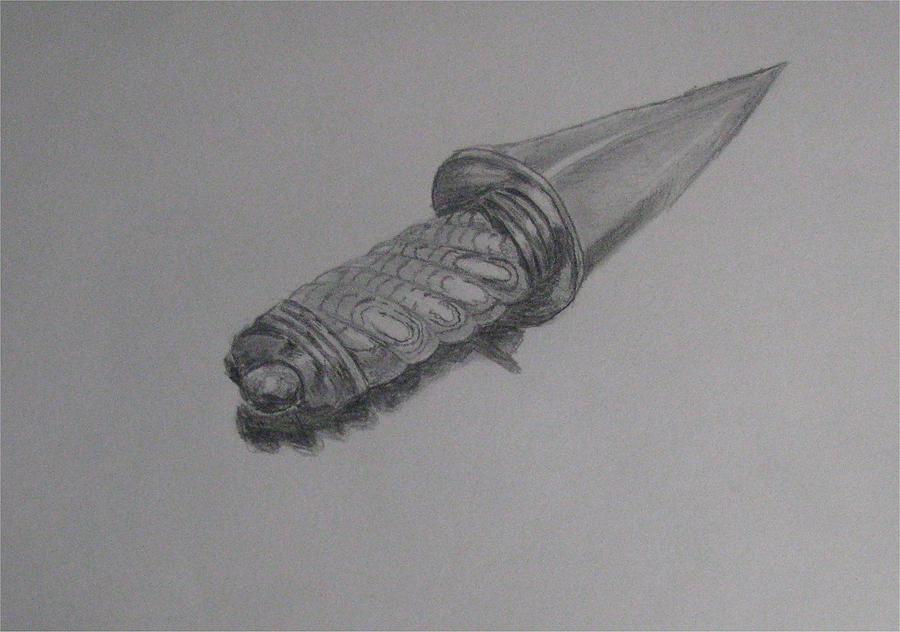
Locate the what looks like a handle in the image. Your answer should be formatted as a list of tuples, i.e. [(x1, y1), (x2, y2), ...], where each tuple contains the x and y coordinates of a point satisfying the conditions above.

[(444, 269)]